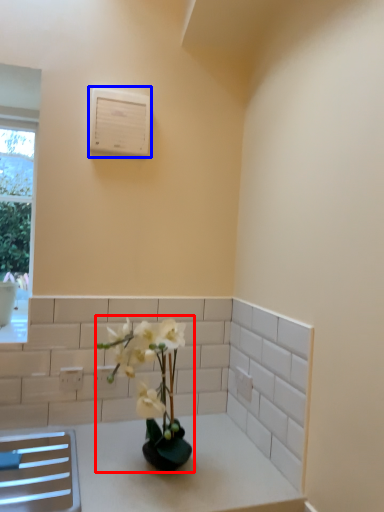
Question: Which object is further to the camera taking this photo, houseplant (highlighted by a red box) or air conditioning (highlighted by a blue box)?

Choices:
 (A) houseplant
 (B) air conditioning

Answer: (B)